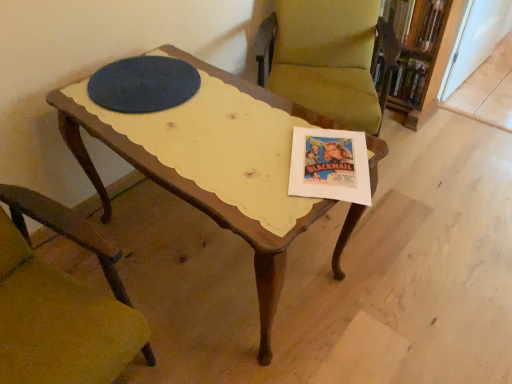
Question: From a real-world perspective, is velvet green chair at center, which is the 2th chair from left to right, physically located above or below hardcover book at upper right?

Choices:
 (A) below
 (B) above

Answer: (A)

Question: Is point (323, 62) positioned closer to the camera than point (425, 11)?

Choices:
 (A) farther
 (B) closer

Answer: (A)

Question: Based on their relative distances, which object is nearer to the velvet green chair at center, which is the 2th chair from bottom to top?

Choices:
 (A) hardcover book at upper right
 (B) wooden chair at lower left, the first chair ordered from the bottom
 (C) wooden bookcase at upper right

Answer: (C)

Question: Which object is positioned closest to the wooden chair at lower left, marked as the 2th chair in a right-to-left arrangement?

Choices:
 (A) wooden bookcase at upper right
 (B) velvet green chair at center, which is the 2th chair from left to right
 (C) hardcover book at upper right

Answer: (B)